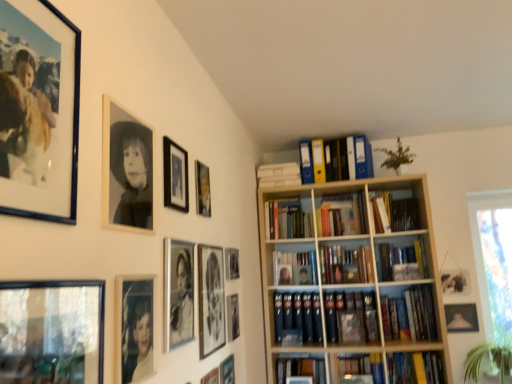
Question: Is yellow plastic file at upper center, which appears as the fifth book when ordered from the bottom, to the left or to the right of matte gold picture frame at lower right, which is the first picture frame from right to left, in the image?

Choices:
 (A) right
 (B) left

Answer: (B)

Question: From the image's perspective, is yellow plastic file at upper center, which appears as the fifth book when ordered from the bottom, above or below matte gold picture frame at lower right, which is the first picture frame from right to left?

Choices:
 (A) below
 (B) above

Answer: (B)

Question: Which is nearer to the hardcover book at center, the third book from the top?

Choices:
 (A) matte black picture frame at center, marked as the eighth picture frame in a left-to-right arrangement
 (B) matte black picture frame at lower center, which appears as the tenth picture frame when viewed from the left
 (C) matte glass photo frame at lower left, arranged as the 4th picture frame when viewed from the left
 (D) clear glass window at lower left, marked as the second picture frame in a left-to-right arrangement
 (E) matte black picture frame at lower center, the 5th picture frame viewed from the right

Answer: (B)

Question: Based on their relative distances, which object is nearer to the matte black picture frame at upper center, the 9th picture frame from the right?

Choices:
 (A) green leafy plant at upper center, placed as the second plant when sorted from right to left
 (B) matte black picture frame at lower center, which appears as the tenth picture frame when viewed from the left
 (C) matte glass photo frame at lower left, arranged as the 4th picture frame when viewed from the left
 (D) yellow plastic file at upper center, placed as the 1th book when sorted from top to bottom
 (E) wooden bookcase at center

Answer: (C)